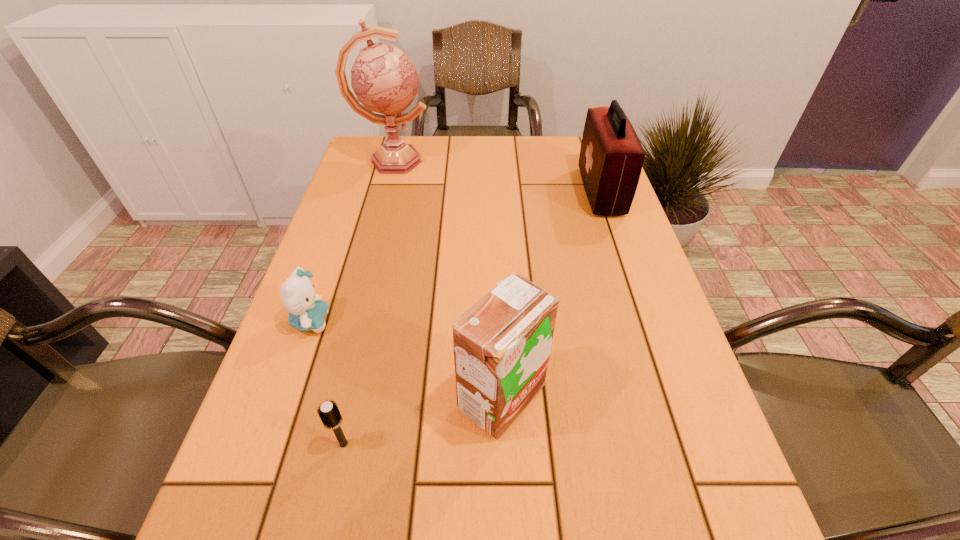
Where is `vacant space located on the straw side of the fourth object from left to right`? The width and height of the screenshot is (960, 540). vacant space located on the straw side of the fourth object from left to right is located at coordinates (363, 397).

At what (x,y) coordinates should I click in order to perform the action: click on vacant space located on the straw side of the fourth object from left to right. Please return your answer as a coordinate pair (x, y). The width and height of the screenshot is (960, 540). Looking at the image, I should click on click(x=351, y=397).

At what (x,y) coordinates should I click in order to perform the action: click on vacant area located 0.390m on the face of the kitten. Please return your answer as a coordinate pair (x, y). The image size is (960, 540). Looking at the image, I should click on (518, 321).

I want to click on vacant position located on the front of the hairbrush, so click(324, 535).

The image size is (960, 540). Find the location of `globe at the far edge`. globe at the far edge is located at coordinates (383, 78).

You are a GUI agent. You are given a task and a screenshot of the screen. Output one action in this format:
    pyautogui.click(x=<x>, y=<y>)
    Task: Click on the first aid kit present at the far edge
    The width and height of the screenshot is (960, 540).
    Given the screenshot: What is the action you would take?
    pyautogui.click(x=611, y=157)

At what (x,y) coordinates should I click in order to perform the action: click on globe positioned at the left edge. Please return your answer as a coordinate pair (x, y). This screenshot has height=540, width=960. Looking at the image, I should click on (383, 78).

You are a GUI agent. You are given a task and a screenshot of the screen. Output one action in this format:
    pyautogui.click(x=<x>, y=<y>)
    Task: Click on the kitten located at the left edge
    The width and height of the screenshot is (960, 540).
    Given the screenshot: What is the action you would take?
    pyautogui.click(x=307, y=311)

The width and height of the screenshot is (960, 540). Find the location of `hairbrush that is at the left edge`. hairbrush that is at the left edge is located at coordinates (329, 413).

At what (x,y) coordinates should I click in order to perform the action: click on object that is positioned at the right edge. Please return your answer as a coordinate pair (x, y). The width and height of the screenshot is (960, 540). Looking at the image, I should click on (611, 157).